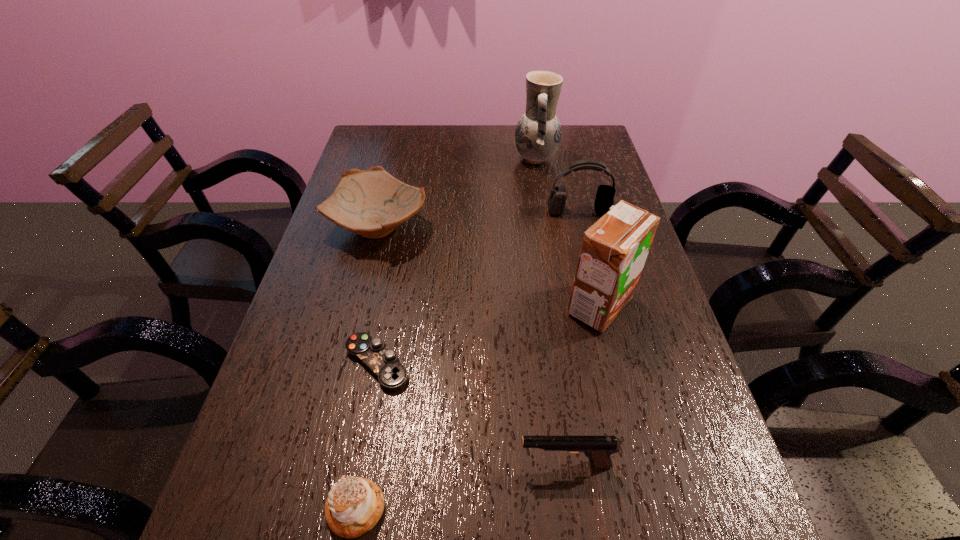
Locate an element on the screen. object that is the fifth closest to the third tallest object is located at coordinates (598, 449).

You are a GUI agent. You are given a task and a screenshot of the screen. Output one action in this format:
    pyautogui.click(x=<x>, y=<y>)
    Task: Click on the object that stands as the sixth closest to the third tallest object
    
    Given the screenshot: What is the action you would take?
    pyautogui.click(x=354, y=505)

Identify the location of free space that satisfies the following two spatial constraints: 1. on the headband of the fifth shortest object; 2. at the muzzle of the pistol. (642, 464).

At what (x,y) coordinates should I click in order to perform the action: click on free space that satisfies the following two spatial constraints: 1. on the headband of the fifth shortest object; 2. on the straw side of the carton. Please return your answer as a coordinate pair (x, y). Looking at the image, I should click on (603, 306).